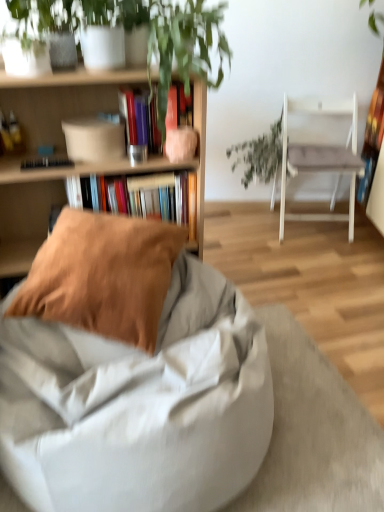
What is the approximate width of light gray fabric bean bag at center, the 1th chair positioned from the bottom?

87.85 centimeters.

What do you see at coordinates (259, 155) in the screenshot?
I see `green leafy plant at center` at bounding box center [259, 155].

Measure the distance between white fabric chair at right, acting as the second chair starting from the left, and camera.

white fabric chair at right, acting as the second chair starting from the left, is 8.30 feet away from camera.

Locate an element on the screen. This screenshot has height=512, width=384. hardcover book at center, which is counted as the 1th book, starting from the top is located at coordinates (140, 118).

What do you see at coordinates (140, 118) in the screenshot?
I see `hardcover book at center, which is counted as the 1th book, starting from the top` at bounding box center [140, 118].

I want to click on hardcover books at center, the first book positioned from the bottom, so click(141, 198).

Considering the points (49, 430) and (66, 277), which point is behind, point (49, 430) or point (66, 277)?

The point (66, 277) is farther from the camera.

Which is in front, light gray fabric bean bag at center, marked as the 1th chair in a left-to-right arrangement, or brown cotton pillow at center?

light gray fabric bean bag at center, marked as the 1th chair in a left-to-right arrangement, is closer to the camera.

Is light gray fabric bean bag at center, marked as the 1th chair in a left-to-right arrangement, situated inside brown cotton pillow at center or outside?

light gray fabric bean bag at center, marked as the 1th chair in a left-to-right arrangement, is outside brown cotton pillow at center.

From a real-world perspective, who is located lower, light gray fabric bean bag at center, which appears as the second chair when viewed from the right, or brown cotton pillow at center?

From a 3D spatial view, light gray fabric bean bag at center, which appears as the second chair when viewed from the right, is below.

From the image's perspective, is light gray fabric bean bag at center, the second chair positioned from the top, on hardcover books at center, marked as the 2th book in a top-to-bottom arrangement?

No, from the image's perspective, light gray fabric bean bag at center, the second chair positioned from the top, is not over hardcover books at center, marked as the 2th book in a top-to-bottom arrangement.

Considering the sizes of objects light gray fabric bean bag at center, marked as the 1th chair in a left-to-right arrangement, and hardcover books at center, the first book positioned from the bottom, in the image provided, who is smaller, light gray fabric bean bag at center, marked as the 1th chair in a left-to-right arrangement, or hardcover books at center, the first book positioned from the bottom,?

hardcover books at center, the first book positioned from the bottom, is smaller.

Can you tell me how much light gray fabric bean bag at center, positioned as the 2th chair in back-to-front order, and hardcover books at center, marked as the 2th book in a top-to-bottom arrangement, differ in facing direction?

0.0516 degrees separate the facing orientations of light gray fabric bean bag at center, positioned as the 2th chair in back-to-front order, and hardcover books at center, marked as the 2th book in a top-to-bottom arrangement.

Find the location of a particular element. book that is the 2nd object located behind the light gray fabric bean bag at center, the 1th chair positioned from the bottom is located at coordinates (141, 198).

Consider the image. Is white fabric chair at right, placed as the 1th chair when sorted from back to front, oriented away from green leafy plant at center?

No, white fabric chair at right, placed as the 1th chair when sorted from back to front,'s orientation is not away from green leafy plant at center.

This screenshot has height=512, width=384. In order to click on vegetation behind the white fabric chair at right, acting as the first chair starting from the top in this screenshot , I will do `click(259, 155)`.

Which of these two, white fabric chair at right, acting as the first chair starting from the top, or green leafy plant at center, is wider?

white fabric chair at right, acting as the first chair starting from the top.

Which object is closer to the camera taking this photo, white fabric chair at right, acting as the second chair starting from the left, or green leafy plant at center?

white fabric chair at right, acting as the second chair starting from the left, is closer to the camera.

Find the location of a particular element. book that is the 2nd object located in front of the white fabric chair at right, acting as the first chair starting from the right is located at coordinates (140, 118).

In the scene shown: Is hardcover book at center, positioned as the 2th book in bottom-to-top order, with white fabric chair at right, acting as the first chair starting from the top?

hardcover book at center, positioned as the 2th book in bottom-to-top order, and white fabric chair at right, acting as the first chair starting from the top, are clearly separated.

From the image's perspective, is brown cotton pillow at center under hardcover books at center, marked as the 2th book in a top-to-bottom arrangement?

Yes.

Is brown cotton pillow at center turned away from hardcover books at center, the first book positioned from the bottom?

Yes, hardcover books at center, the first book positioned from the bottom, is at the back of brown cotton pillow at center.

Locate an element on the screen. book on the left side of hardcover book at center, positioned as the 2th book in bottom-to-top order is located at coordinates (141, 198).

From the image's perspective, between hardcover books at center, marked as the 2th book in a top-to-bottom arrangement, and hardcover book at center, which is counted as the 1th book, starting from the top, which one is located above?

From the image's view, hardcover book at center, which is counted as the 1th book, starting from the top, is above.

Is hardcover books at center, the first book positioned from the bottom, far from hardcover book at center, which is counted as the 1th book, starting from the top?

No, hardcover books at center, the first book positioned from the bottom, is in close proximity to hardcover book at center, which is counted as the 1th book, starting from the top.

Considering the relative positions of wooden bookshelf at upper left and hardcover books at center, the first book positioned from the bottom, in the image provided, is wooden bookshelf at upper left to the left of hardcover books at center, the first book positioned from the bottom, from the viewer's perspective?

Yes, wooden bookshelf at upper left is to the left of hardcover books at center, the first book positioned from the bottom.

From a real-world perspective, between wooden bookshelf at upper left and hardcover books at center, the first book positioned from the bottom, who is vertically higher?

wooden bookshelf at upper left, from a real-world perspective.

From the image's perspective, is wooden bookshelf at upper left below hardcover books at center, marked as the 2th book in a top-to-bottom arrangement?

Yes, from the image's perspective, wooden bookshelf at upper left is beneath hardcover books at center, marked as the 2th book in a top-to-bottom arrangement.

Where is `chair below the brown cotton pillow at center (from the image's perspective)`? chair below the brown cotton pillow at center (from the image's perspective) is located at coordinates (138, 405).

The image size is (384, 512). In order to click on the 2nd book behind the light gray fabric bean bag at center, the second chair positioned from the top, counting from the anchor's position in this screenshot , I will do `click(141, 198)`.

Which object lies further to the anchor point green leafy plant at center, hardcover book at center, which is counted as the 1th book, starting from the top, or brown cotton pillow at center?

Based on the image, brown cotton pillow at center appears to be further to green leafy plant at center.

Estimate the real-world distances between objects in this image. Which object is closer to hardcover book at center, positioned as the 2th book in bottom-to-top order, light gray fabric bean bag at center, the first chair when ordered from front to back, or wooden bookshelf at upper left?

wooden bookshelf at upper left is closer to hardcover book at center, positioned as the 2th book in bottom-to-top order.

When comparing their distances from wooden bookshelf at upper left, does light gray fabric bean bag at center, the first chair when ordered from front to back, or hardcover books at center, the first book positioned from the bottom, seem closer?

hardcover books at center, the first book positioned from the bottom.

Based on their spatial positions, is light gray fabric bean bag at center, which appears as the second chair when viewed from the right, or white fabric chair at right, acting as the second chair starting from the bottom, closer to hardcover book at center, positioned as the 2th book in bottom-to-top order?

light gray fabric bean bag at center, which appears as the second chair when viewed from the right.

Looking at the image, which one is located further to brown cotton pillow at center, hardcover book at center, which is counted as the 1th book, starting from the top, or hardcover books at center, the first book positioned from the bottom?

hardcover book at center, which is counted as the 1th book, starting from the top, is positioned further to the anchor brown cotton pillow at center.

When comparing their distances from white fabric chair at right, acting as the first chair starting from the right, does green leafy plant at center or hardcover books at center, marked as the 2th book in a top-to-bottom arrangement, seem closer?

green leafy plant at center.

When comparing their distances from light gray fabric bean bag at center, which appears as the second chair when viewed from the right, does green leafy plant at center or wooden bookshelf at upper left seem closer?

Based on the image, wooden bookshelf at upper left appears to be nearer to light gray fabric bean bag at center, which appears as the second chair when viewed from the right.

Considering their positions, is white fabric chair at right, acting as the first chair starting from the top, positioned further to light gray fabric bean bag at center, the second chair positioned from the top, than hardcover book at center, which is counted as the 1th book, starting from the top?

Based on the image, white fabric chair at right, acting as the first chair starting from the top, appears to be further to light gray fabric bean bag at center, the second chair positioned from the top.

I want to click on shelf between hardcover book at center, which is counted as the 1th book, starting from the top, and brown cotton pillow at center from top to bottom, so click(x=65, y=196).

The image size is (384, 512). Find the location of `pillow positioned between light gray fabric bean bag at center, positioned as the 2th chair in back-to-front order, and green leafy plant at center from near to far`. pillow positioned between light gray fabric bean bag at center, positioned as the 2th chair in back-to-front order, and green leafy plant at center from near to far is located at coordinates (103, 275).

Where is `pillow situated between wooden bookshelf at upper left and white fabric chair at right, the second chair from the front, from left to right`? pillow situated between wooden bookshelf at upper left and white fabric chair at right, the second chair from the front, from left to right is located at coordinates (103, 275).

Locate an element on the screen. chair between wooden bookshelf at upper left and green leafy plant at center in the front-back direction is located at coordinates (321, 158).